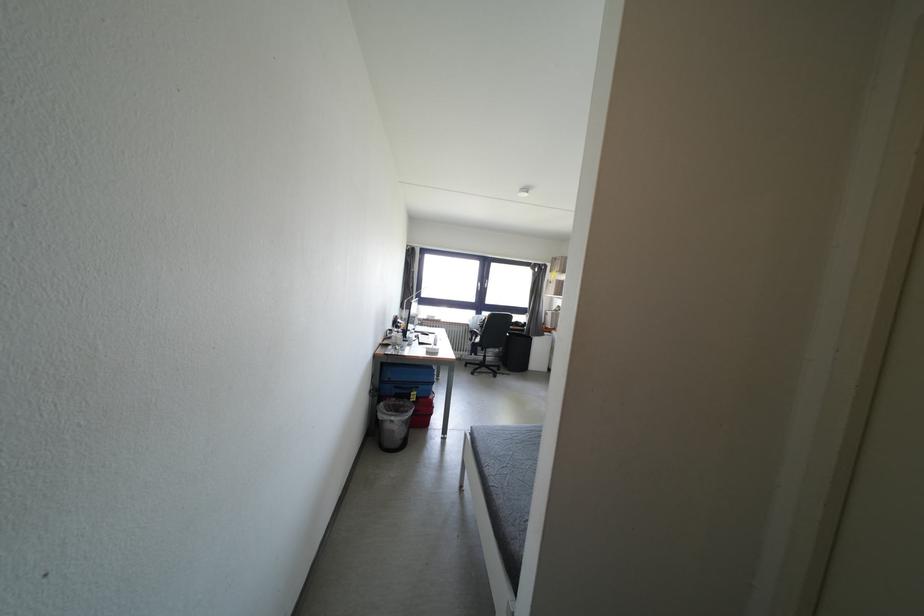
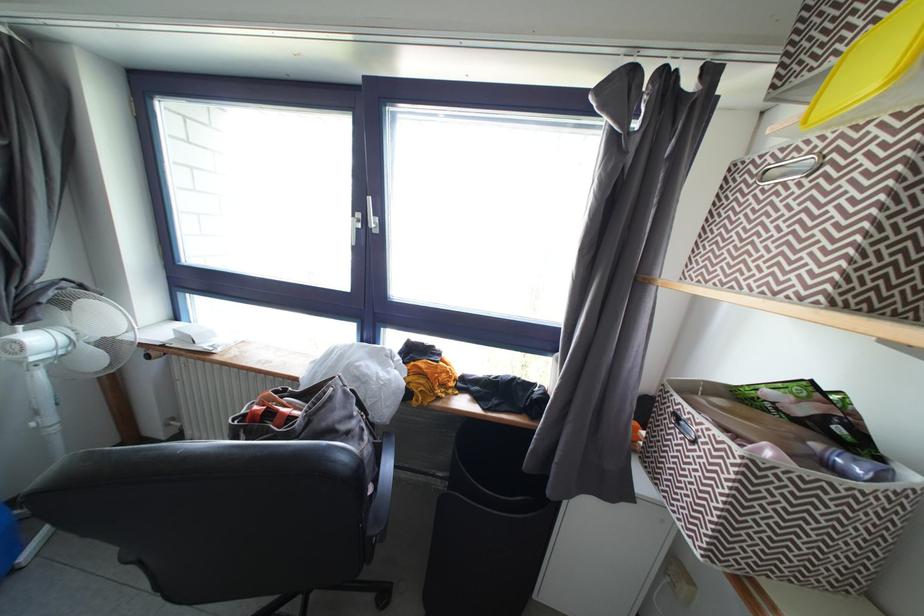
Question: Which direction would the cameraman need to move to produce the second image? Reply with the corresponding letter.

Choices:
 (A) Left
 (B) Right
 (C) Forward
 (D) Backward

Answer: (C)